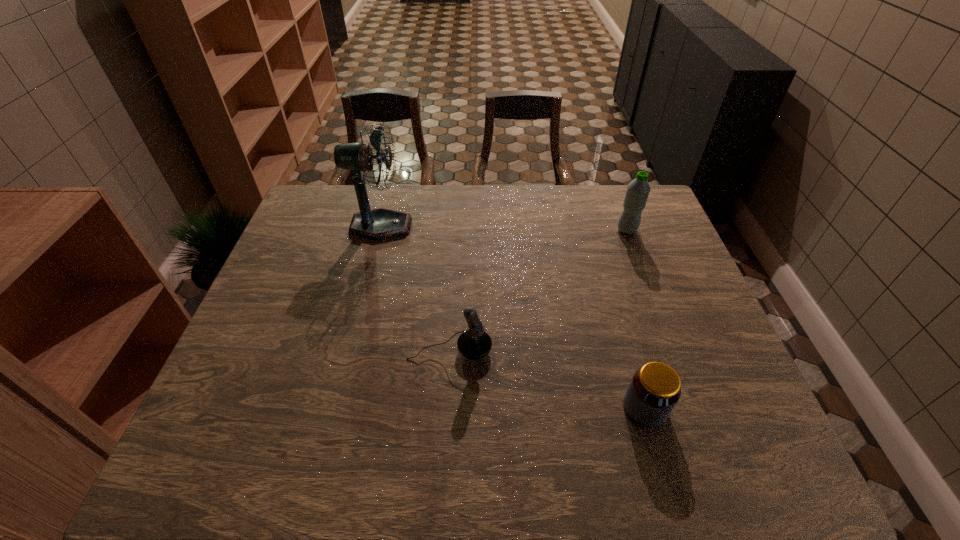
The image size is (960, 540). I want to click on empty space between the water bottle and the fan, so click(504, 228).

In order to click on empty space that is in between the jar and the fan in this screenshot , I will do pyautogui.click(x=513, y=318).

Identify the location of the closest object to the water bottle. click(655, 388).

The height and width of the screenshot is (540, 960). I want to click on the second closest object relative to the water bottle, so click(x=474, y=343).

Identify the location of free region that satisfies the following two spatial constraints: 1. in front of the tallest object where the wind blows; 2. on the right side of the water bottle. (380, 230).

This screenshot has height=540, width=960. Find the location of `free spot that satisfies the following two spatial constraints: 1. in front of the rightmost object where the wind blows; 2. on the left side of the leftmost object`. free spot that satisfies the following two spatial constraints: 1. in front of the rightmost object where the wind blows; 2. on the left side of the leftmost object is located at coordinates (380, 230).

You are a GUI agent. You are given a task and a screenshot of the screen. Output one action in this format:
    pyautogui.click(x=<x>, y=<y>)
    Task: Click on the vacant position in the image that satisfies the following two spatial constraints: 1. on the back side of the shortest object; 2. in front of the leftmost object where the wind blows
    The width and height of the screenshot is (960, 540).
    Given the screenshot: What is the action you would take?
    pyautogui.click(x=592, y=226)

This screenshot has height=540, width=960. Identify the location of free space that satisfies the following two spatial constraints: 1. in front of the leftmost object where the wind blows; 2. on the back side of the second nearest object. (349, 350).

Identify the location of blank area in the image that satisfies the following two spatial constraints: 1. on the front side of the nearest object; 2. on the left side of the second nearest object. (446, 408).

Identify the location of free space that satisfies the following two spatial constraints: 1. in front of the third object from left to right where the wind blows; 2. on the right side of the tallest object. The image size is (960, 540). (335, 408).